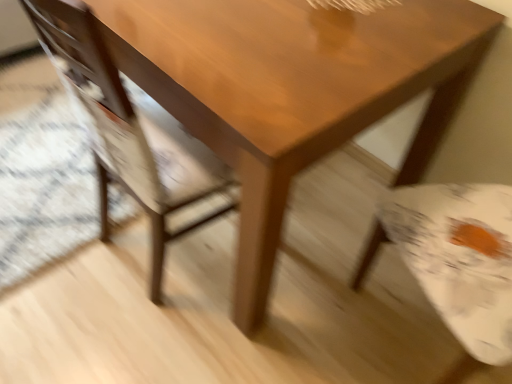
Find the location of `free space in front of matte wood chair at center`. free space in front of matte wood chair at center is located at coordinates (143, 336).